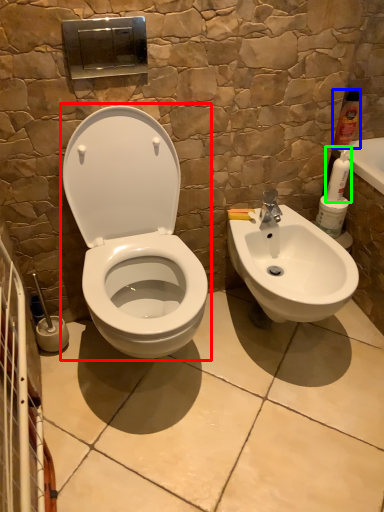
Question: Which object is positioned closest to toilet (highlighted by a red box)? Select from cleaning product (highlighted by a blue box) and cleaning product (highlighted by a green box).

Choices:
 (A) cleaning product
 (B) cleaning product

Answer: (B)